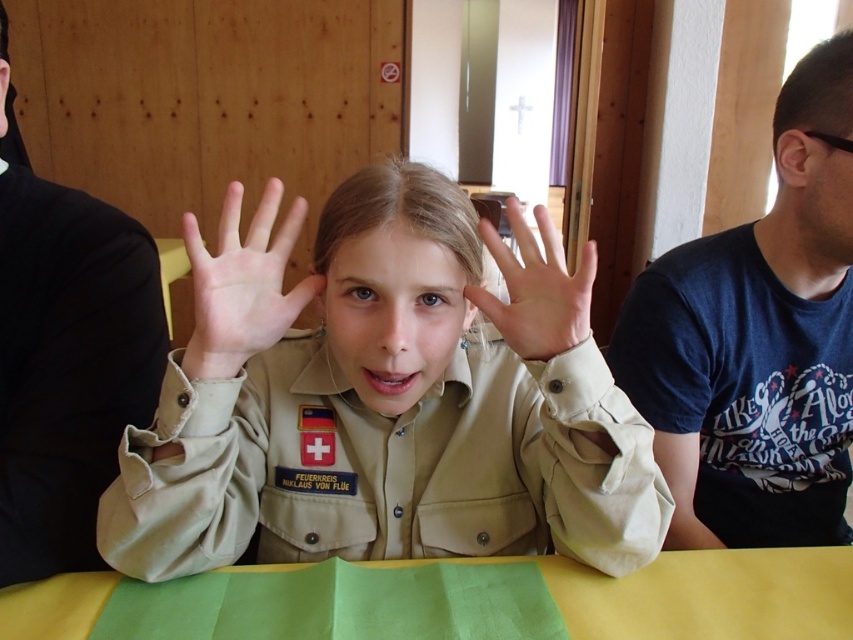
Does tan uniform at center have a larger size compared to matte beige hand at center?

Indeed, tan uniform at center has a larger size compared to matte beige hand at center.

Between tan uniform at center and matte beige hand at center, which one is positioned lower?

tan uniform at center is below.

Does point (386, 452) come farther from viewer compared to point (541, 296)?

Yes, it is.

This screenshot has height=640, width=853. What are the coordinates of `tan uniform at center` in the screenshot? It's located at (384, 401).

Who is more distant from viewer, (x=311, y=397) or (x=238, y=209)?

Positioned behind is point (x=311, y=397).

Who is more forward, (x=245, y=256) or (x=190, y=348)?

Point (x=190, y=348) is in front.

What do you see at coordinates (384, 401) in the screenshot? The width and height of the screenshot is (853, 640). I see `tan uniform at center` at bounding box center [384, 401].

I want to click on tan uniform at center, so click(x=384, y=401).

Can you confirm if black fabric shirt at left is shorter than smooth beige hand at center?

No, black fabric shirt at left is not shorter than smooth beige hand at center.

Which is in front, point (4, 529) or point (258, 308)?

Point (258, 308)

I want to click on black fabric shirt at left, so click(68, 365).